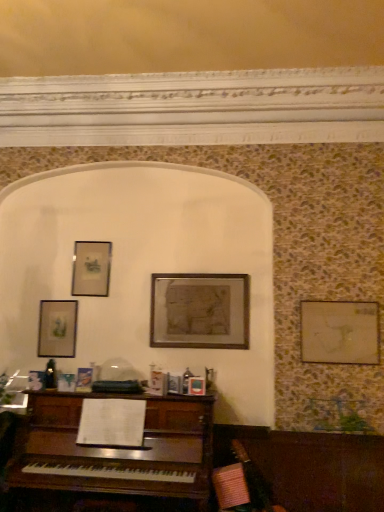
Question: Can you see matte silver picture frame at upper left, placed as the third picture frame when sorted from right to left, touching wooden framed map at center, the 2th picture frame from the right?

Choices:
 (A) yes
 (B) no

Answer: (B)

Question: Is matte silver picture frame at upper left, placed as the third picture frame when sorted from right to left, facing away from wooden framed map at center, the 2th picture frame from the right?

Choices:
 (A) yes
 (B) no

Answer: (B)

Question: Is matte silver picture frame at upper left, the second picture frame from the left, shorter than wooden framed map at center, which is counted as the 3th picture frame, starting from the left?

Choices:
 (A) no
 (B) yes

Answer: (B)

Question: Is wooden framed map at center, which is counted as the 3th picture frame, starting from the left, surrounded by matte silver picture frame at upper left, placed as the third picture frame when sorted from right to left?

Choices:
 (A) no
 (B) yes

Answer: (A)

Question: Would you say matte silver picture frame at upper left, placed as the third picture frame when sorted from right to left, is outside wooden framed map at center, the 2th picture frame from the right?

Choices:
 (A) yes
 (B) no

Answer: (A)

Question: Based on their sizes in the image, would you say matte silver picture frame at upper left, the second picture frame from the left, is bigger or smaller than wooden framed map at center, which is counted as the 3th picture frame, starting from the left?

Choices:
 (A) small
 (B) big

Answer: (A)

Question: Looking at their shapes, would you say matte silver picture frame at upper left, the second picture frame from the left, is wider or thinner than wooden framed map at center, the 2th picture frame from the right?

Choices:
 (A) thin
 (B) wide

Answer: (A)

Question: From the image's perspective, is matte silver picture frame at upper left, placed as the third picture frame when sorted from right to left, located above or below wooden framed map at center, which is counted as the 3th picture frame, starting from the left?

Choices:
 (A) below
 (B) above

Answer: (B)

Question: From a real-world perspective, relative to wooden framed map at center, the 2th picture frame from the right, is matte silver picture frame at upper left, the second picture frame from the left, vertically above or below?

Choices:
 (A) above
 (B) below

Answer: (A)

Question: Is wooden framed map at center, which is counted as the 3th picture frame, starting from the left, situated inside matte glass picture frame at upper left, arranged as the 1th picture frame when viewed from the left, or outside?

Choices:
 (A) outside
 (B) inside

Answer: (A)

Question: Considering the relative positions of wooden framed map at center, which is counted as the 3th picture frame, starting from the left, and matte glass picture frame at upper left, which ranks as the 4th picture frame in right-to-left order, in the image provided, is wooden framed map at center, which is counted as the 3th picture frame, starting from the left, to the left or to the right of matte glass picture frame at upper left, which ranks as the 4th picture frame in right-to-left order,?

Choices:
 (A) right
 (B) left

Answer: (A)

Question: Relative to matte glass picture frame at upper left, which ranks as the 4th picture frame in right-to-left order, is wooden framed map at center, the 2th picture frame from the right, in front or behind?

Choices:
 (A) behind
 (B) front

Answer: (B)

Question: Based on their sizes in the image, would you say wooden framed map at center, which is counted as the 3th picture frame, starting from the left, is bigger or smaller than matte glass picture frame at upper left, which ranks as the 4th picture frame in right-to-left order?

Choices:
 (A) small
 (B) big

Answer: (B)

Question: Based on their sizes in the image, would you say matte silver picture frame at upper left, the second picture frame from the left, is bigger or smaller than matte glass picture frame at upper left, which ranks as the 4th picture frame in right-to-left order?

Choices:
 (A) small
 (B) big

Answer: (A)

Question: In the image, is matte silver picture frame at upper left, placed as the third picture frame when sorted from right to left, on the left side or the right side of matte glass picture frame at upper left, which ranks as the 4th picture frame in right-to-left order?

Choices:
 (A) right
 (B) left

Answer: (A)